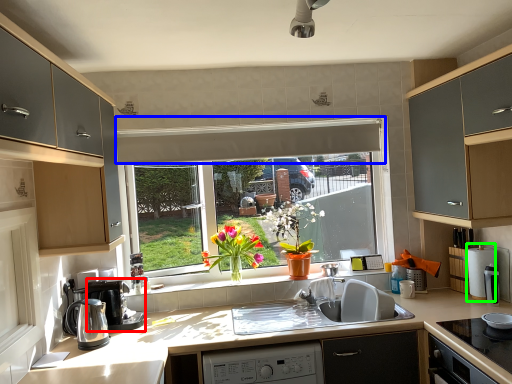
Question: Considering the real-world distances, which object is farthest from coffee machine (highlighted by a red box)? exhaust hood (highlighted by a blue box) or appliance (highlighted by a green box)?

Choices:
 (A) exhaust hood
 (B) appliance

Answer: (B)